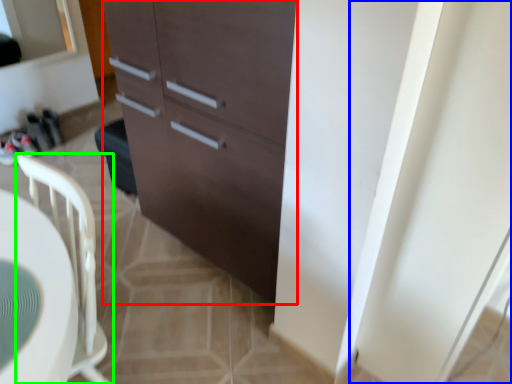
Question: Considering the real-world distances, which object is closest to cabinetry (highlighted by a red box)? screen door (highlighted by a blue box) or chair (highlighted by a green box).

Choices:
 (A) screen door
 (B) chair

Answer: (B)